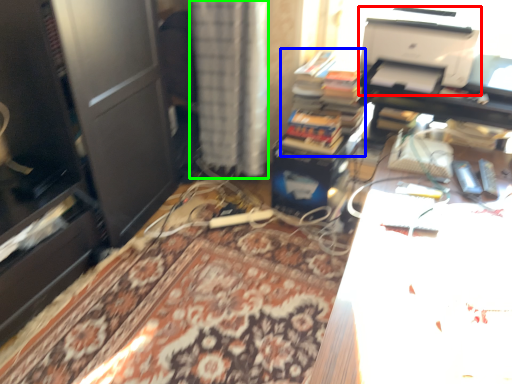
Question: Estimate the real-world distances between objects in this image. Which object is farther from printer (highlighted by a red box), book (highlighted by a blue box) or curtain (highlighted by a green box)?

Choices:
 (A) book
 (B) curtain

Answer: (B)